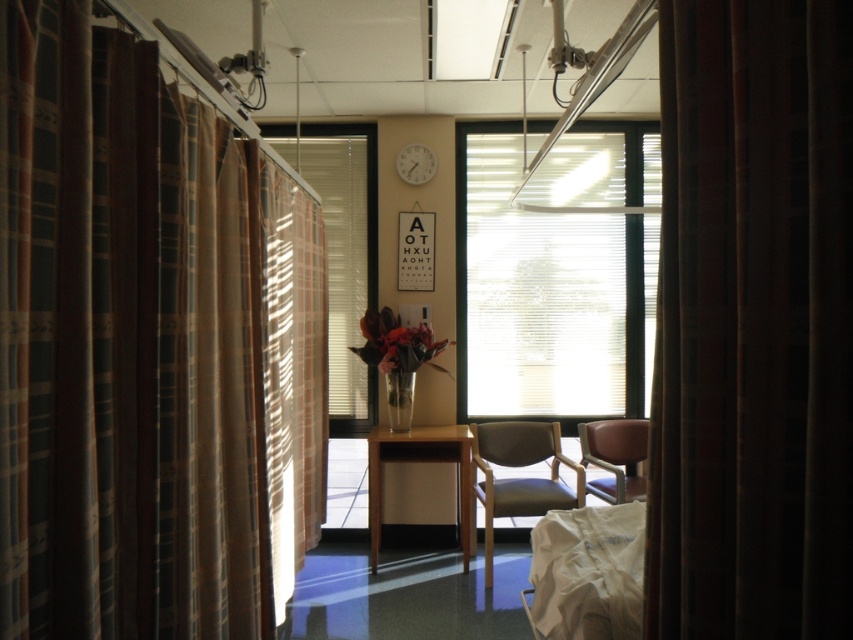
Question: Does light brown wooden table at center appear over white plastic clock at upper center?

Choices:
 (A) no
 (B) yes

Answer: (A)

Question: Among these objects, which one is nearest to the camera?

Choices:
 (A) white translucent blinds at center
 (B) translucent fabric window at center
 (C) light brown wooden table at center
 (D) white plastic clock at upper center

Answer: (C)

Question: Estimate the real-world distances between objects in this image. Which object is farther from the leather armchair at center?

Choices:
 (A) white translucent blinds at center
 (B) white plastic clock at upper center
 (C) light brown wooden table at center
 (D) plaid fabric curtain at right

Answer: (D)

Question: Is the position of plaid fabric curtain at left less distant than that of beige fabric armchair at center?

Choices:
 (A) yes
 (B) no

Answer: (A)

Question: Considering the relative positions of plaid fabric curtain at left and translucent fabric window at center in the image provided, where is plaid fabric curtain at left located with respect to translucent fabric window at center?

Choices:
 (A) below
 (B) above

Answer: (A)

Question: Which object appears farthest from the camera in this image?

Choices:
 (A) plaid fabric curtain at right
 (B) translucent fabric window at center
 (C) leather armchair at center

Answer: (B)